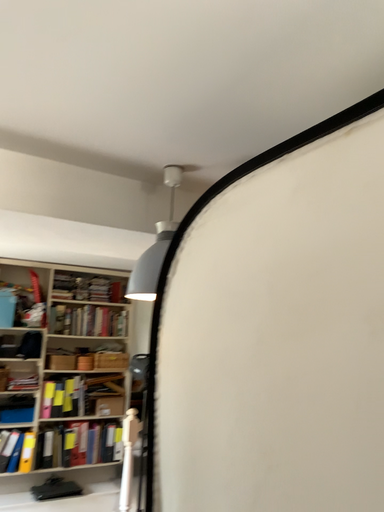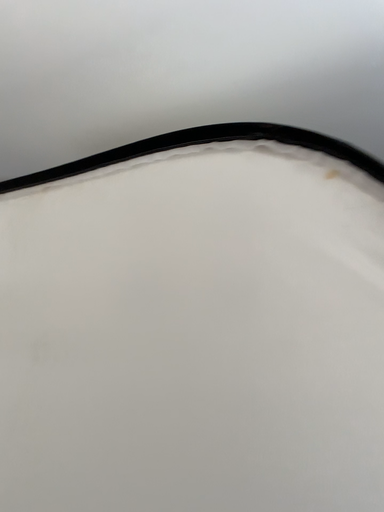
Question: How did the camera likely rotate when shooting the video?

Choices:
 (A) rotated right
 (B) rotated left

Answer: (A)